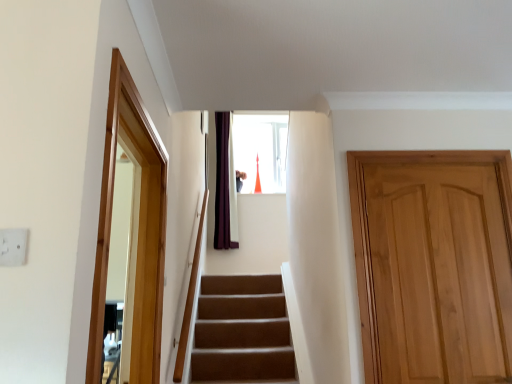
The height and width of the screenshot is (384, 512). Describe the element at coordinates (434, 265) in the screenshot. I see `light brown wood door at right` at that location.

I want to click on light brown wood door at right, so click(434, 265).

Locate an element on the screen. Image resolution: width=512 pixels, height=384 pixels. wooden frame at left is located at coordinates (137, 229).

What do you see at coordinates (137, 229) in the screenshot? Image resolution: width=512 pixels, height=384 pixels. I see `wooden frame at left` at bounding box center [137, 229].

Locate an element on the screen. Image resolution: width=512 pixels, height=384 pixels. light brown wood door at right is located at coordinates (434, 265).

Which is more to the right, light brown wood door at right or wooden frame at left?

light brown wood door at right.

Consider the image. Is light brown wood door at right closer to camera compared to wooden frame at left?

No, light brown wood door at right is further to the viewer.

Considering the points (385, 267) and (140, 286), which point is in front, point (385, 267) or point (140, 286)?

The point (140, 286) is closer to the camera.

From the image's perspective, would you say light brown wood door at right is positioned over wooden frame at left?

Incorrect, from the image's perspective, light brown wood door at right is lower than wooden frame at left.

From a real-world perspective, is light brown wood door at right physically located above or below wooden frame at left?

light brown wood door at right is below wooden frame at left.

Does light brown wood door at right have a greater width compared to wooden frame at left?

No.

Which of these two, light brown wood door at right or wooden frame at left, stands shorter?

wooden frame at left is shorter.

Is light brown wood door at right bigger than wooden frame at left?

Actually, light brown wood door at right might be smaller than wooden frame at left.

Would you say light brown wood door at right is outside wooden frame at left?

Yes, light brown wood door at right is not within wooden frame at left.

Is light brown wood door at right beside wooden frame at left?

No, light brown wood door at right is not with wooden frame at left.

In the scene shown: Does light brown wood door at right turn towards wooden frame at left?

No, light brown wood door at right is not facing towards wooden frame at left.

Identify the location of screen door above the light brown wood door at right (from the image's perspective). (137, 229).

Is wooden frame at left to the left of light brown wood door at right from the viewer's perspective?

Correct, you'll find wooden frame at left to the left of light brown wood door at right.

Is wooden frame at left positioned in front of light brown wood door at right?

Yes, the depth of wooden frame at left is less than that of light brown wood door at right.

Which is behind, point (147, 217) or point (371, 193)?

The point (371, 193) is farther.

Consider the image. From the image's perspective, is wooden frame at left above or below light brown wood door at right?

From the image's perspective, wooden frame at left appears above light brown wood door at right.

From a real-world perspective, which object stands above the other?

wooden frame at left is physically above.

Between wooden frame at left and light brown wood door at right, which one has smaller width?

With smaller width is light brown wood door at right.

Considering the relative sizes of wooden frame at left and light brown wood door at right in the image provided, is wooden frame at left shorter than light brown wood door at right?

Correct, wooden frame at left is not as tall as light brown wood door at right.

Which of these two, wooden frame at left or light brown wood door at right, is smaller?

With smaller size is light brown wood door at right.

Is light brown wood door at right surrounded by wooden frame at left?

No, wooden frame at left does not contain light brown wood door at right.

Is wooden frame at left not close to light brown wood door at right?

Indeed, wooden frame at left is not near light brown wood door at right.

Is wooden frame at left facing away from light brown wood door at right?

No, wooden frame at left's orientation is not away from light brown wood door at right.

Find the location of a particular element. door below the wooden frame at left (from a real-world perspective) is located at coordinates (434, 265).

At what (x,y) coordinates should I click in order to perform the action: click on screen door on the left of light brown wood door at right. Please return your answer as a coordinate pair (x, y). This screenshot has width=512, height=384. Looking at the image, I should click on (137, 229).

Locate an element on the screen. This screenshot has width=512, height=384. door below the wooden frame at left (from the image's perspective) is located at coordinates (434, 265).